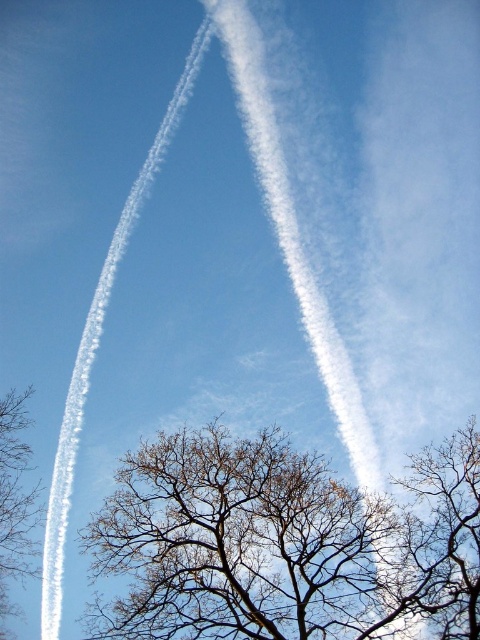
Question: Among these points, which one is nearest to the camera?

Choices:
 (A) (456, 490)
 (B) (429, 620)

Answer: (B)

Question: Where is brown leafless branches at center located in relation to brown leafless branches at left in the image?

Choices:
 (A) left
 (B) right

Answer: (B)

Question: Does bare branches at center appear over brown leafless branches at left?

Choices:
 (A) no
 (B) yes

Answer: (B)

Question: Does bare branches at center have a greater width compared to brown leafless branches at center?

Choices:
 (A) yes
 (B) no

Answer: (A)

Question: Estimate the real-world distances between objects in this image. Which object is closer to the brown leafless branches at left?

Choices:
 (A) brown leafless branches at center
 (B) bare branches at center

Answer: (B)

Question: Which of the following is the closest to the observer?

Choices:
 (A) (450, 464)
 (B) (4, 563)
 (C) (192, 625)

Answer: (C)